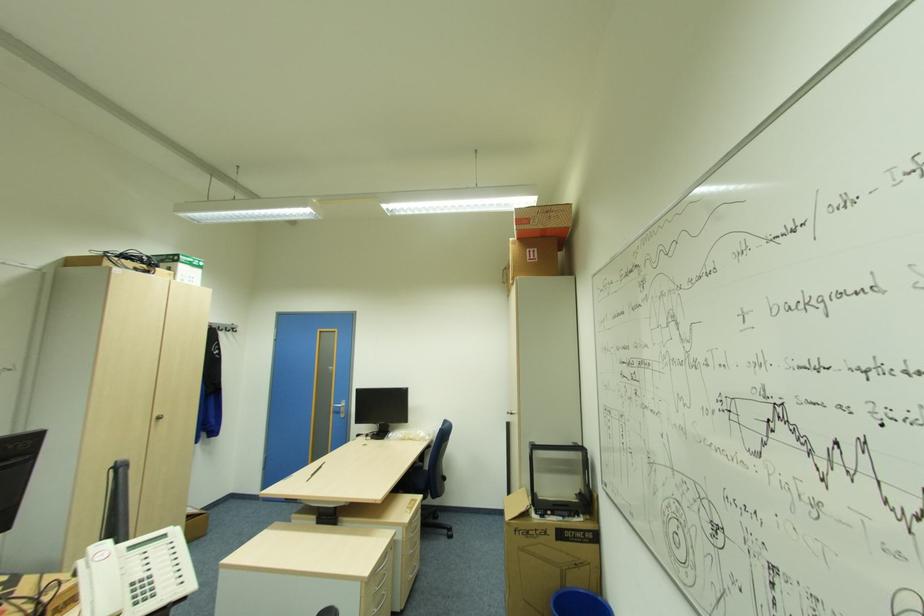
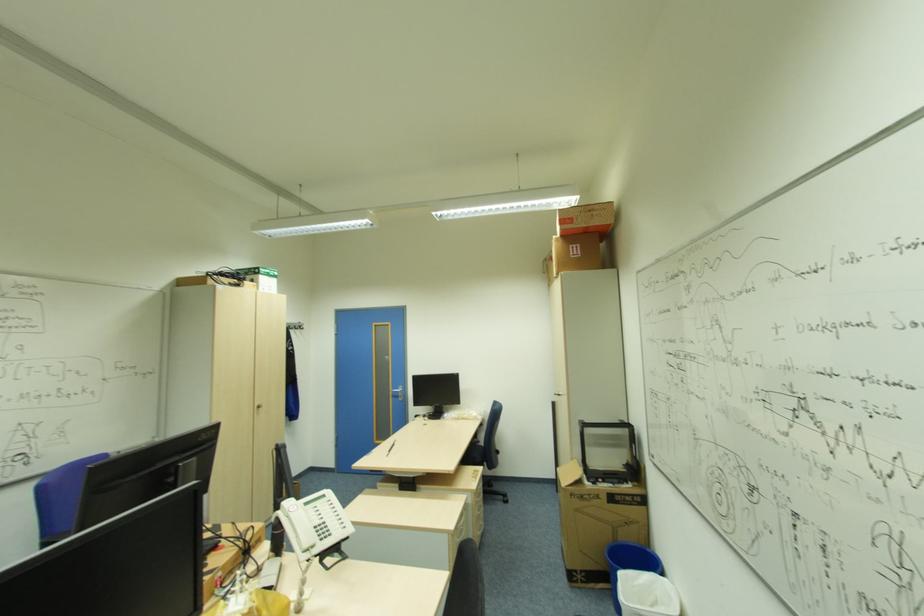
The images are taken continuously from a first-person perspective. In which direction are you moving?

A: The cameraman walked toward left, backward.